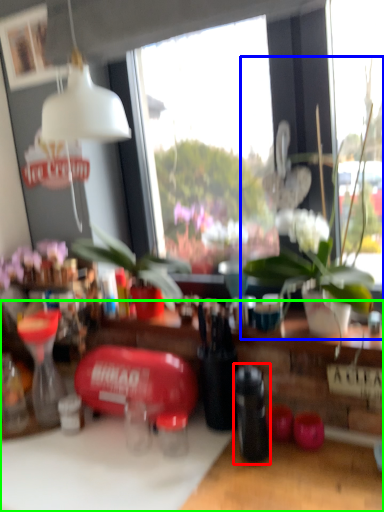
Question: Which object is the closest to the bottle (highlighted by a red box)? Choose among these: houseplant (highlighted by a blue box) or table (highlighted by a green box).

Choices:
 (A) houseplant
 (B) table

Answer: (B)